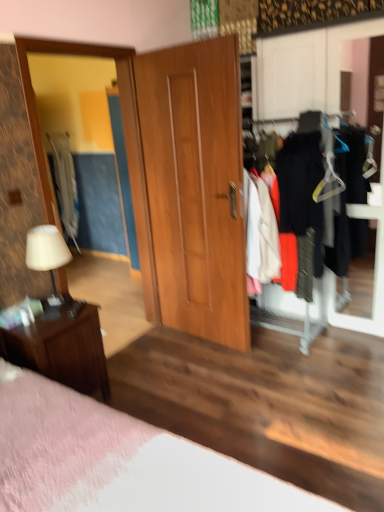
Question: Based on their positions, is light gray fabric coat at left located to the left or right of matte wooden mirror at left?

Choices:
 (A) left
 (B) right

Answer: (A)

Question: Looking at the image, does light gray fabric coat at left seem bigger or smaller compared to matte wooden mirror at left?

Choices:
 (A) small
 (B) big

Answer: (A)

Question: Which of these objects is positioned closest to the matte black clothes at right?

Choices:
 (A) light gray fabric coat at left
 (B) matte white lamp at left
 (C) wooden door at center
 (D) brown wood nightstand at lower left
 (E) matte wooden mirror at left

Answer: (C)

Question: Estimate the real-world distances between objects in this image. Which object is farther from the matte wooden mirror at left?

Choices:
 (A) matte black clothes at right
 (B) pink fabric bed at lower left
 (C) wooden door at center
 (D) light gray fabric coat at left
 (E) matte white lamp at left

Answer: (D)